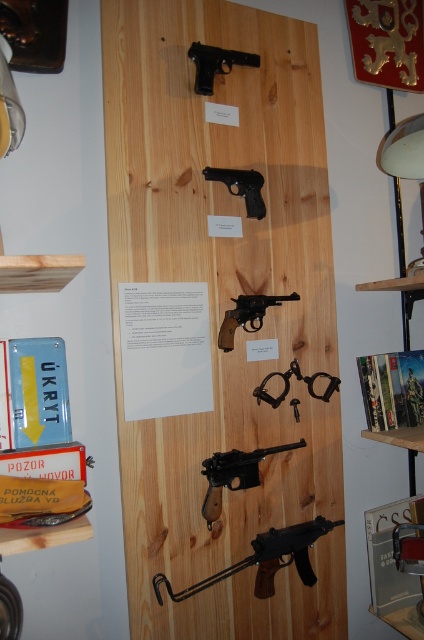
Does matte brown revolver at center appear on the right side of matte black pistol at center?

Indeed, matte brown revolver at center is positioned on the right side of matte black pistol at center.

This screenshot has height=640, width=424. In order to click on matte brown revolver at center in this screenshot , I will do `click(248, 316)`.

Image resolution: width=424 pixels, height=640 pixels. I want to click on matte brown revolver at center, so click(x=248, y=316).

Where is `matte brown revolver at center`? The width and height of the screenshot is (424, 640). matte brown revolver at center is located at coordinates (248, 316).

Can you confirm if wooden signboard at center is shorter than matte black pistol at center?

Incorrect, wooden signboard at center's height does not fall short of matte black pistol at center's.

Between wooden signboard at center and matte black pistol at center, which one appears on the right side from the viewer's perspective?

Positioned to the right is matte black pistol at center.

Is point (286, 122) less distant than point (231, 180)?

No, it is behind (231, 180).

Find the location of `wooden signboard at center`. wooden signboard at center is located at coordinates (223, 308).

Based on the photo, can you confirm if white glossy lampshade at upper right is smaller than matte black pistol at center?

No.

Which is more to the right, white glossy lampshade at upper right or matte black pistol at center?

white glossy lampshade at upper right

Which is behind, point (398, 243) or point (217, 177)?

The point (398, 243) is more distant.

Locate an element on the screen. The height and width of the screenshot is (640, 424). white glossy lampshade at upper right is located at coordinates (402, 164).